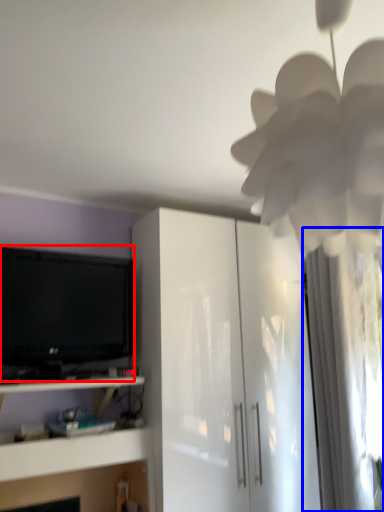
Question: Which point is closer to the camera, television (highlighted by a red box) or curtain (highlighted by a blue box)?

Choices:
 (A) television
 (B) curtain

Answer: (A)